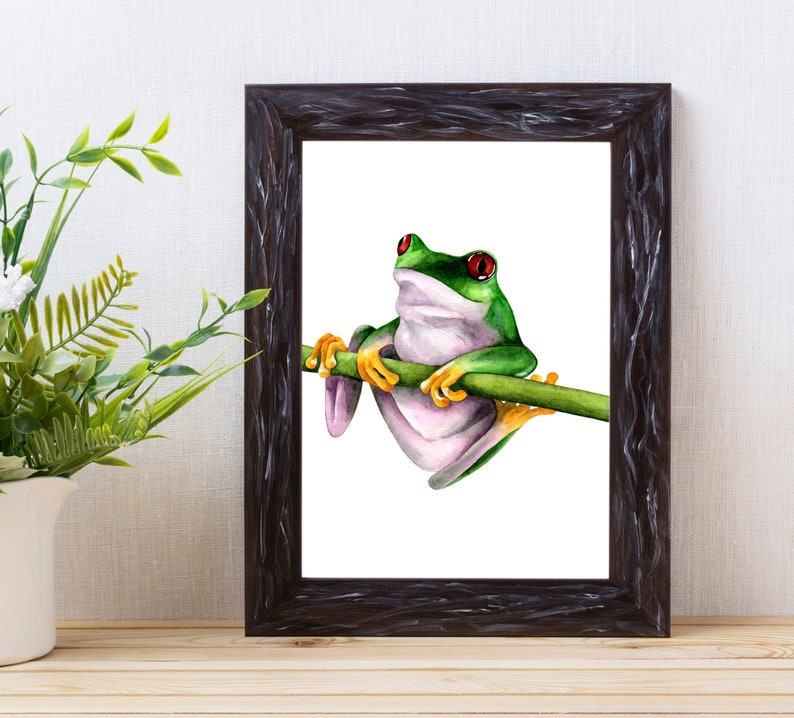
I want to click on countertop, so click(357, 676).